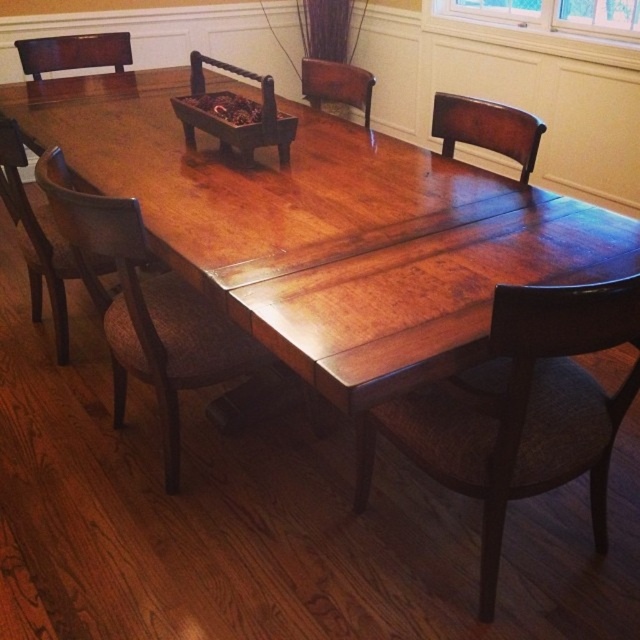
Question: Which point is farther to the camera?

Choices:
 (A) (492, 20)
 (B) (172, 100)

Answer: (A)

Question: Which point appears closest to the camera in this image?

Choices:
 (A) (600, 1)
 (B) (100, 61)
 (C) (19, 225)
 (D) (524, 145)

Answer: (D)

Question: Which of the following is the farthest from the observer?

Choices:
 (A) wooden tray at center
 (B) mahogany wood armchair at upper center
 (C) mahogany wood chair at right

Answer: (B)

Question: Does brown woven chair at lower right have a smaller size compared to mahogany wood chair at right?

Choices:
 (A) no
 (B) yes

Answer: (A)

Question: Is shiny wood table at center smaller than mahogany wood chair at right?

Choices:
 (A) no
 (B) yes

Answer: (A)

Question: Is brown woven chair at lower right positioned before dark brown wood armchair at upper left?

Choices:
 (A) yes
 (B) no

Answer: (A)